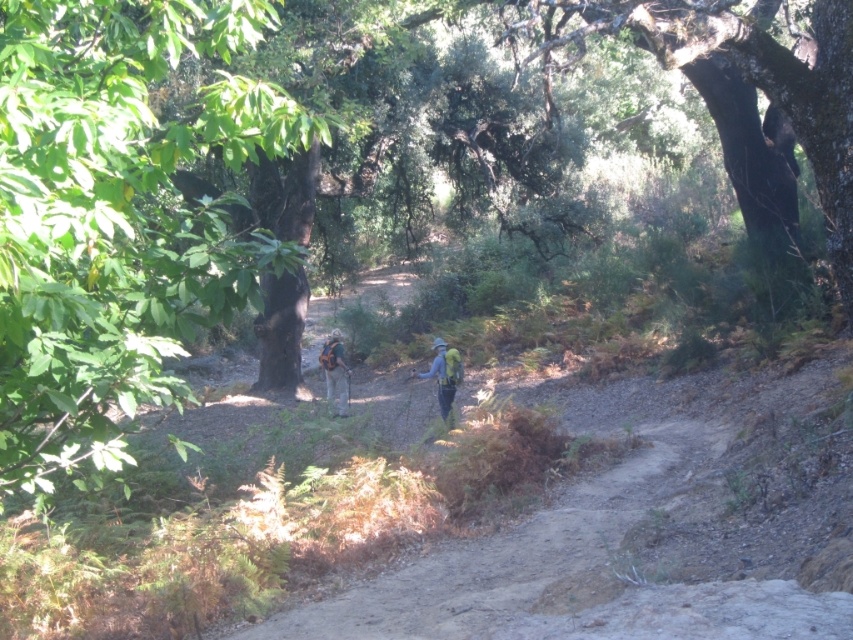
Question: Can you confirm if green leafy tree at upper left is wider than dirt path at center?

Choices:
 (A) yes
 (B) no

Answer: (B)

Question: Which point is farther to the camera?

Choices:
 (A) blue fabric backpack at center
 (B) camouflage backpack at center
 (C) green leafy tree at upper left

Answer: (B)

Question: Which point is closer to the camera?

Choices:
 (A) (456, 355)
 (B) (192, 4)

Answer: (B)

Question: Can you confirm if camouflage fabric backpack at center is wider than camouflage backpack at center?

Choices:
 (A) no
 (B) yes

Answer: (A)

Question: Is camouflage fabric backpack at center thinner than camouflage backpack at center?

Choices:
 (A) yes
 (B) no

Answer: (A)

Question: Considering the real-world distances, which object is farthest from the camouflage backpack at center?

Choices:
 (A) blue fabric backpack at center
 (B) green leafy tree at upper left
 (C) dirt path at center
 (D) camouflage fabric backpack at center

Answer: (B)